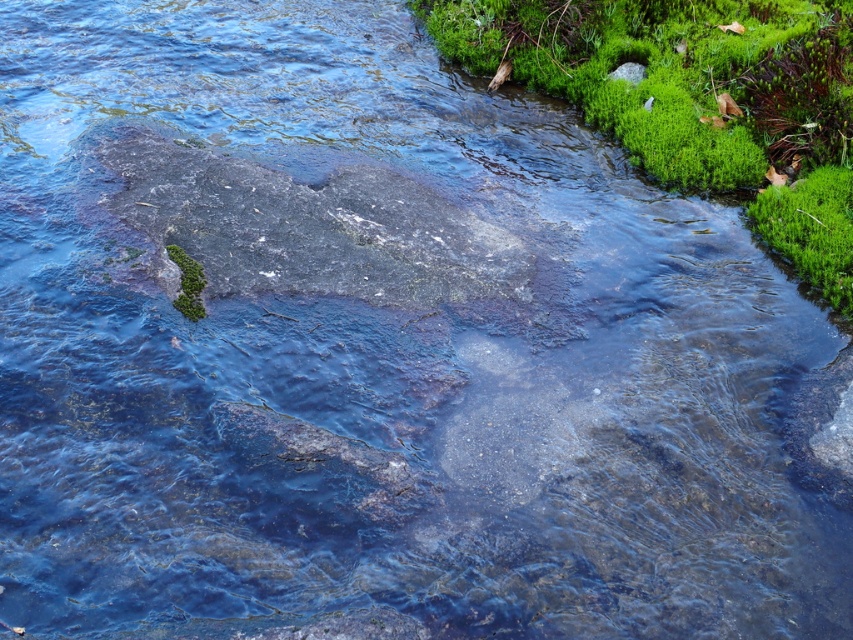
You are a hiker who wants to cross the stream carefully. The green mossy algae at upper right and the green mossy rock at lower left are both in your path. Which one should you avoid stepping on to prevent slipping?

You should avoid stepping on the green mossy algae at upper right because it has a larger size compared to the green mossy rock at lower left, making it more slippery.

You are a botanist studying the distribution of green mossy algae in the scene. Based on the coordinates provided, where exactly would you find the green mossy algae at upper right?

The green mossy algae at upper right is located at point coordinates of (697, 99).

You are standing at the edge of the stream and notice a point marked at coordinates (x=697, y=99). According to the scene description, where exactly is this point located?

The point at (x=697, y=99) is located on the green mossy algae at the upper right of the scene.